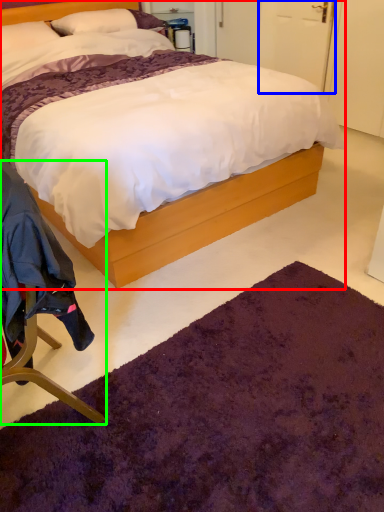
Question: Which object is positioned farthest from bed (highlighted by a red box)? Select from door (highlighted by a blue box) and chair (highlighted by a green box).

Choices:
 (A) door
 (B) chair

Answer: (A)